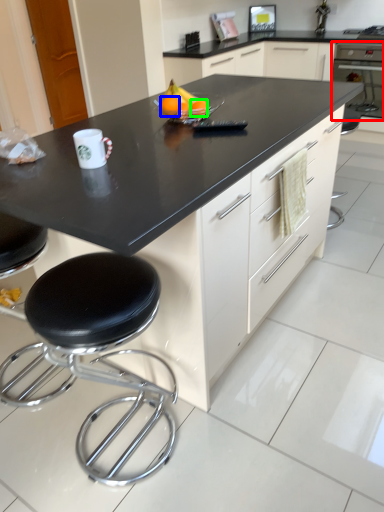
Question: Which object is positioned farthest from oven (highlighted by a red box)? Select from orange (highlighted by a blue box) and orange (highlighted by a green box).

Choices:
 (A) orange
 (B) orange

Answer: (A)